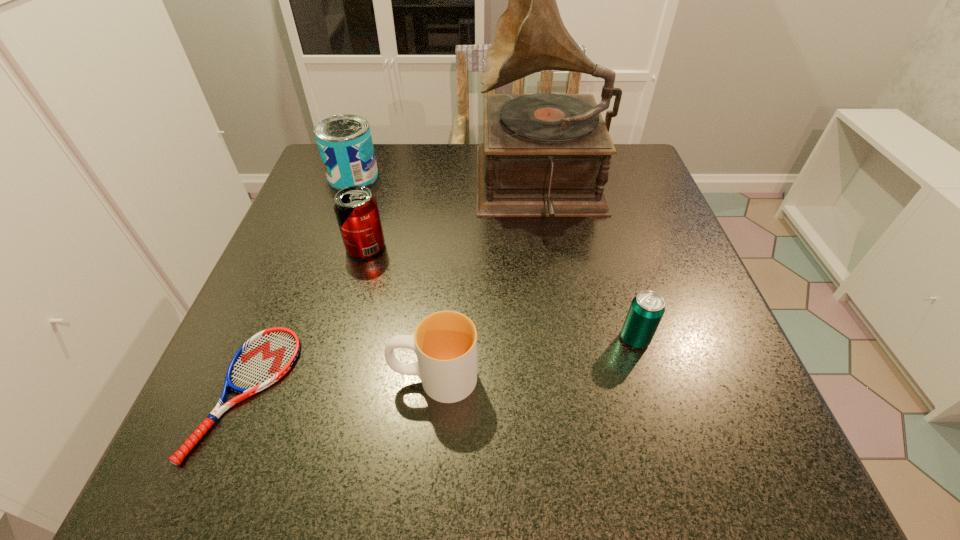
Where is `vacant space that's between the tennis racket and the record player`? vacant space that's between the tennis racket and the record player is located at coordinates (394, 289).

Where is `free space between the record player and the can`? The width and height of the screenshot is (960, 540). free space between the record player and the can is located at coordinates (447, 181).

At what (x,y) coordinates should I click in order to perform the action: click on vacant space in between the soda can and the beer can. Please return your answer as a coordinate pair (x, y). This screenshot has width=960, height=540. Looking at the image, I should click on (500, 293).

Where is `the third closest object to the shortest object`? Image resolution: width=960 pixels, height=540 pixels. the third closest object to the shortest object is located at coordinates (544, 154).

Identify which object is the fourth closest to the can. Please provide its 2D coordinates. Your answer should be formatted as a tuple, i.e. [(x, y)], where the tuple contains the x and y coordinates of a point satisfying the conditions above.

[(445, 342)]

I want to click on vacant position in the image that satisfies the following two spatial constraints: 1. from the horn of the record player; 2. on the front side of the shortest object, so click(575, 392).

The height and width of the screenshot is (540, 960). I want to click on vacant space that satisfies the following two spatial constraints: 1. with the handle on the side of the cup; 2. on the left side of the beer can, so click(x=438, y=339).

Find the location of a particular element. The width and height of the screenshot is (960, 540). free location that satisfies the following two spatial constraints: 1. with the handle on the side of the cup; 2. on the front side of the can is located at coordinates (451, 176).

Find the location of a particular element. free space that satisfies the following two spatial constraints: 1. on the front side of the soda can; 2. on the right side of the can is located at coordinates (327, 247).